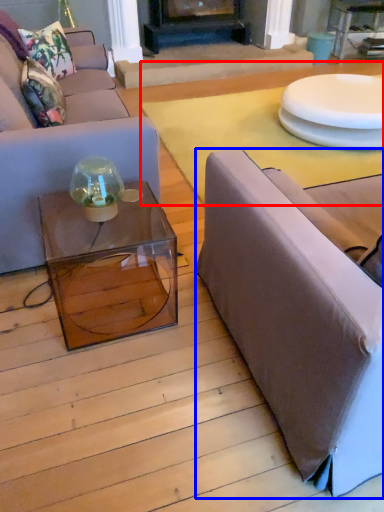
Question: Which object appears closest to the camera in this image, plain (highlighted by a red box) or studio couch (highlighted by a blue box)?

Choices:
 (A) plain
 (B) studio couch

Answer: (B)